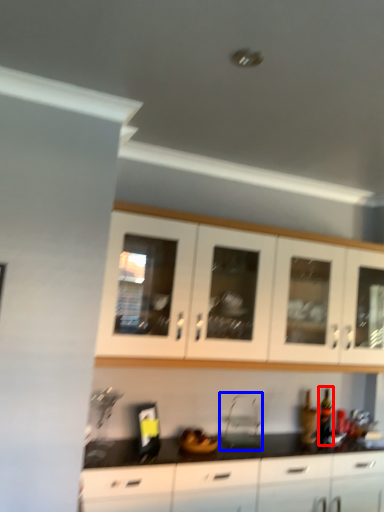
Question: Among these objects, which one is nearest to the camera, bottle (highlighted by a red box) or appliance (highlighted by a blue box)?

Choices:
 (A) bottle
 (B) appliance

Answer: (B)